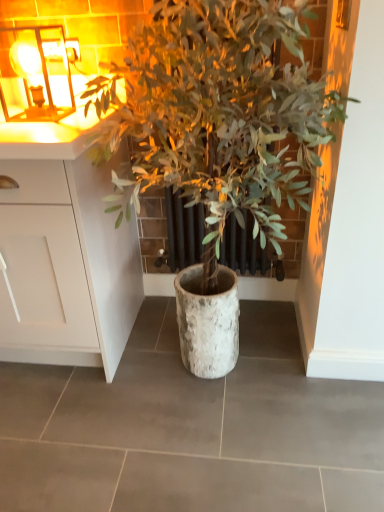
Question: Is white matte cabinet at left at the left side of green leafy plant at center?

Choices:
 (A) yes
 (B) no

Answer: (A)

Question: Is white matte cabinet at left positioned beyond the bounds of green leafy plant at center?

Choices:
 (A) yes
 (B) no

Answer: (A)

Question: Is white matte cabinet at left taller than green leafy plant at center?

Choices:
 (A) no
 (B) yes

Answer: (A)

Question: Is white matte cabinet at left placed right next to green leafy plant at center?

Choices:
 (A) no
 (B) yes

Answer: (A)

Question: Is white matte cabinet at left positioned with its back to green leafy plant at center?

Choices:
 (A) yes
 (B) no

Answer: (B)

Question: From the image's perspective, is metallic glass at upper left positioned above or below green leafy plant at center?

Choices:
 (A) above
 (B) below

Answer: (A)

Question: Considering the positions of point [x=6, y=62] and point [x=258, y=155], is point [x=6, y=62] closer or farther from the camera than point [x=258, y=155]?

Choices:
 (A) farther
 (B) closer

Answer: (A)

Question: Do you think metallic glass at upper left is within green leafy plant at center, or outside of it?

Choices:
 (A) outside
 (B) inside

Answer: (A)

Question: Relative to green leafy plant at center, is metallic glass at upper left in front or behind?

Choices:
 (A) behind
 (B) front

Answer: (A)

Question: Considering the positions of white matte cabinet at left and green leafy plant at center in the image, is white matte cabinet at left taller or shorter than green leafy plant at center?

Choices:
 (A) tall
 (B) short

Answer: (B)

Question: Relative to green leafy plant at center, is white matte cabinet at left in front or behind?

Choices:
 (A) front
 (B) behind

Answer: (B)

Question: From a real-world perspective, is white matte cabinet at left positioned above or below green leafy plant at center?

Choices:
 (A) below
 (B) above

Answer: (A)

Question: Is white matte cabinet at left wider or thinner than green leafy plant at center?

Choices:
 (A) wide
 (B) thin

Answer: (A)

Question: Relative to white matte cabinet at left, is metallic glass at upper left in front or behind?

Choices:
 (A) front
 (B) behind

Answer: (B)

Question: Looking at their shapes, would you say metallic glass at upper left is wider or thinner than white matte cabinet at left?

Choices:
 (A) thin
 (B) wide

Answer: (A)